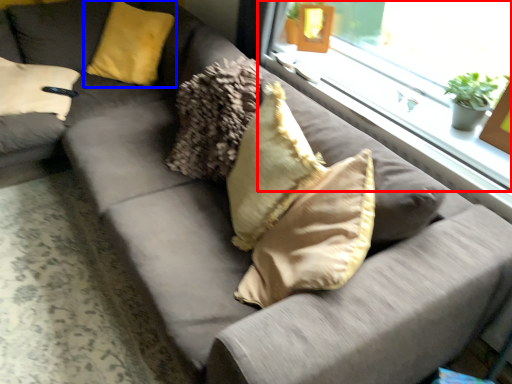
Question: Which of the following is the closest to the observer, window (highlighted by a red box) or pillow (highlighted by a blue box)?

Choices:
 (A) window
 (B) pillow

Answer: (A)